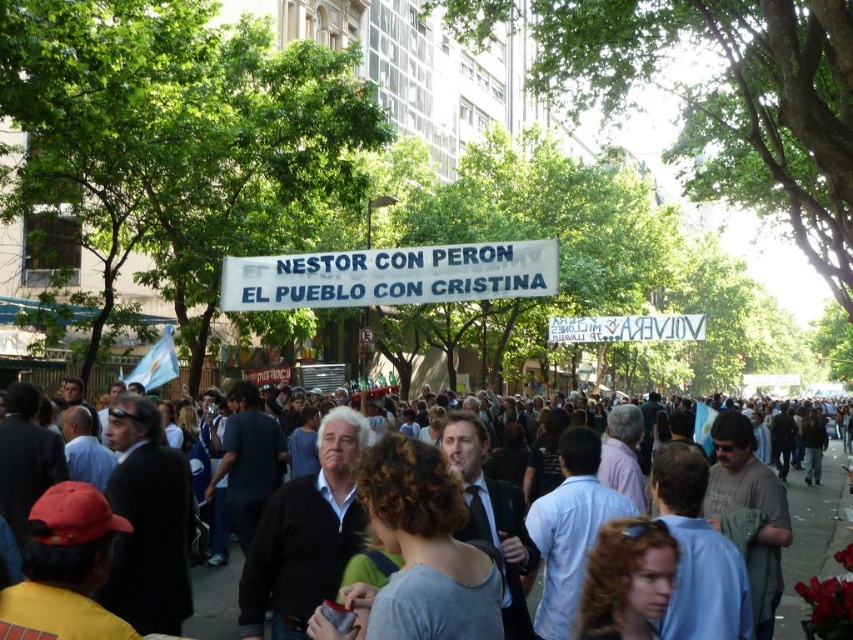
Who is positioned more to the left, white paper banner at center or gray cotton shirt at center?

Positioned to the left is white paper banner at center.

Does white paper banner at center have a smaller size compared to gray cotton shirt at center?

Indeed, white paper banner at center has a smaller size compared to gray cotton shirt at center.

The height and width of the screenshot is (640, 853). In order to click on white paper banner at center in this screenshot , I will do `click(390, 275)`.

Where is `white paper banner at center`? white paper banner at center is located at coordinates (390, 275).